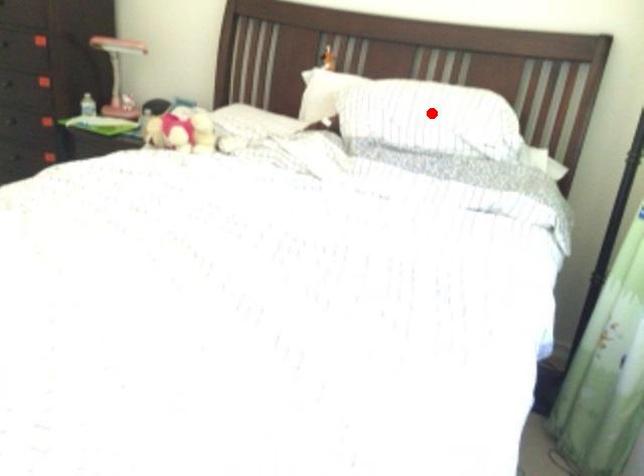
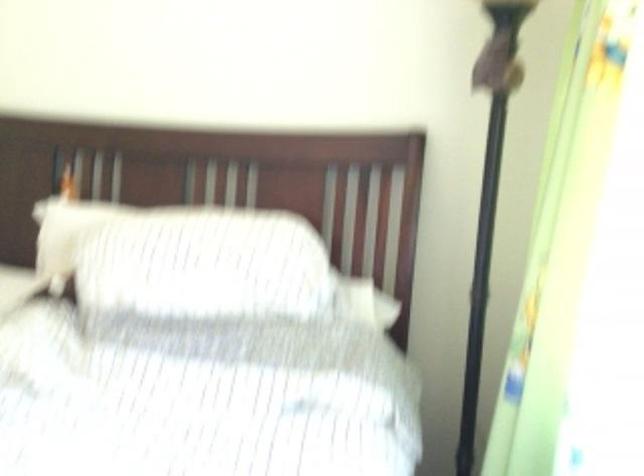
Question: I am providing you with two images of the same scene from different viewpoints. Given a red point in image1, look at the same physical point in image2. Is it:

Choices:
 (A) Closer to the viewpoint
 (B) Farther from the viewpoint

Answer: (A)